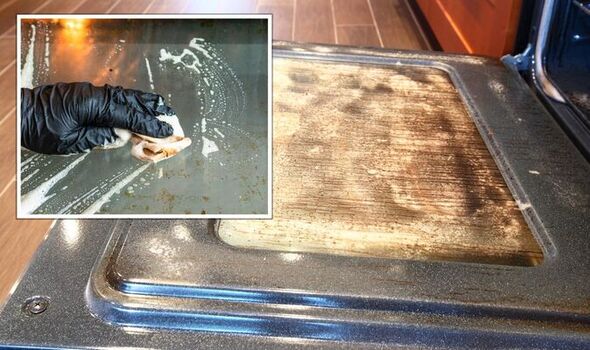
Image resolution: width=590 pixels, height=350 pixels. In order to click on oven door in this screenshot , I will do `click(64, 325)`.